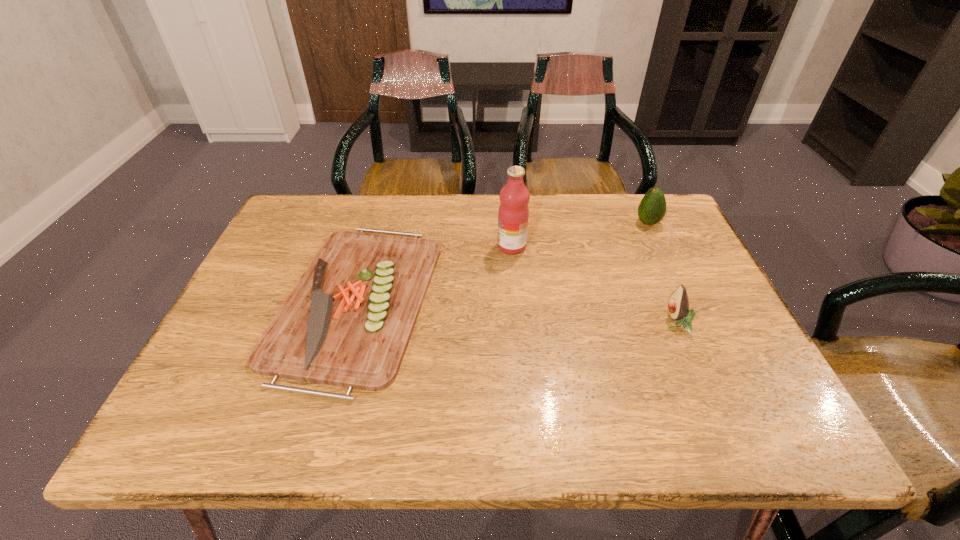
Identify the location of object at the near left corner. (347, 322).

Find the location of `object situated at the far right corner`. object situated at the far right corner is located at coordinates (652, 208).

You are a GUI agent. You are given a task and a screenshot of the screen. Output one action in this format:
    pyautogui.click(x=<x>, y=<y>)
    Task: Click on the blank space at the far edge of the desktop
    The image size is (960, 540).
    Given the screenshot: What is the action you would take?
    pyautogui.click(x=361, y=195)

I want to click on vacant space at the left edge of the desktop, so click(x=193, y=396).

In the image, there is a desktop. Where is `vacant space at the right edge`? This screenshot has width=960, height=540. vacant space at the right edge is located at coordinates (669, 250).

At what (x,y) coordinates should I click in order to perform the action: click on free point at the far left corner. Please return your answer as a coordinate pair (x, y). Looking at the image, I should click on (296, 215).

Locate an element on the screen. The width and height of the screenshot is (960, 540). vacant space at the near right corner of the desktop is located at coordinates (767, 433).

The height and width of the screenshot is (540, 960). I want to click on unoccupied position between the farther avocado and the nearer avocado, so tap(661, 273).

The image size is (960, 540). Identify the location of unoccupied area between the chopping board and the nearer avocado. 516,312.

Where is `empty space between the nearer avocado and the second object from left to right`? empty space between the nearer avocado and the second object from left to right is located at coordinates (593, 285).